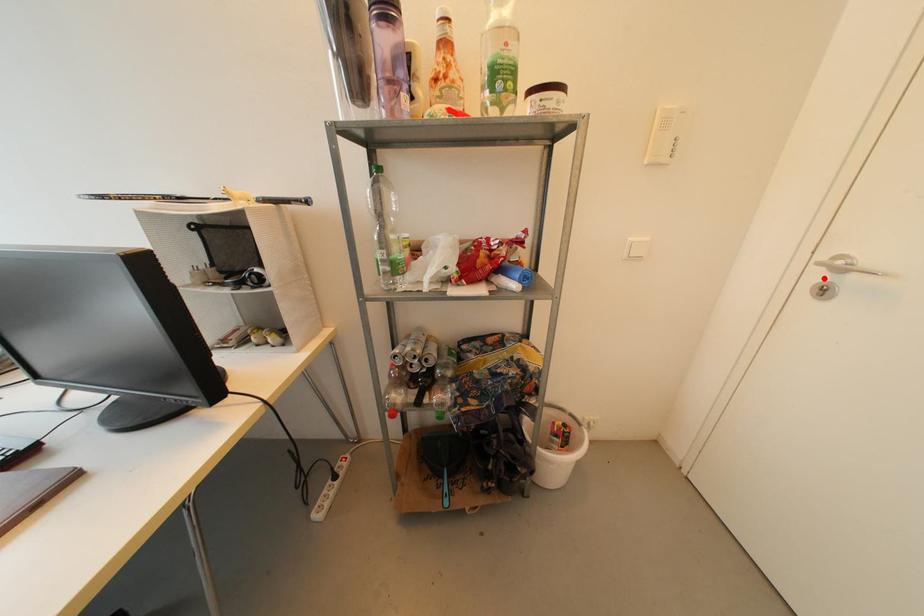
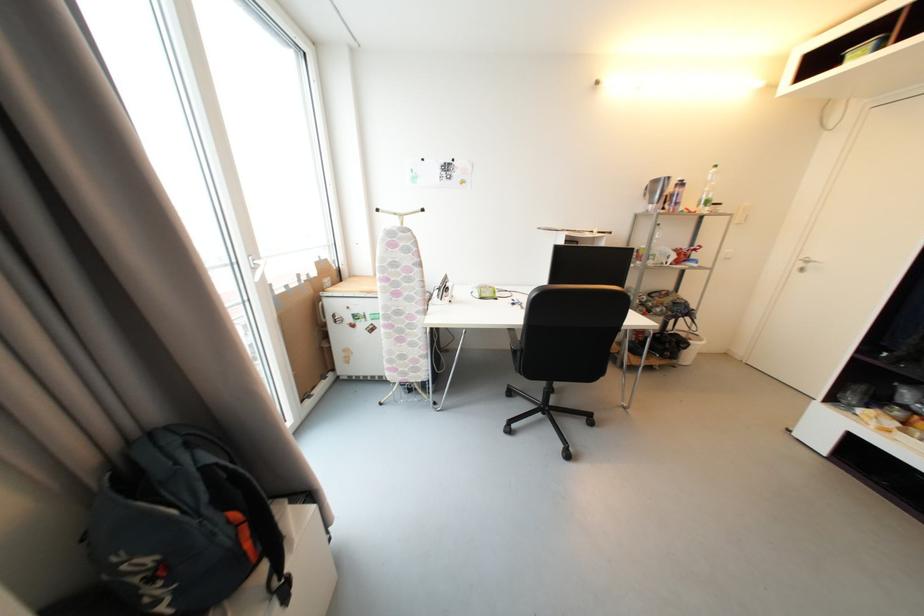
Question: I am providing you with two images of the same scene from different viewpoints. A red point is marked on the first image. Is the red point's position out of view in image 2?

Choices:
 (A) Yes
 (B) No

Answer: (B)